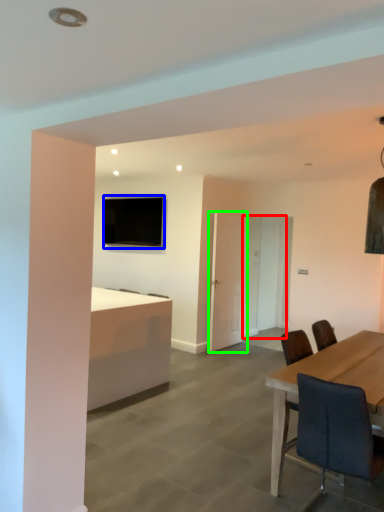
Question: Which is nearer to the glass door (highlighted by a red box)? television (highlighted by a blue box) or glass door (highlighted by a green box).

Choices:
 (A) television
 (B) glass door

Answer: (B)